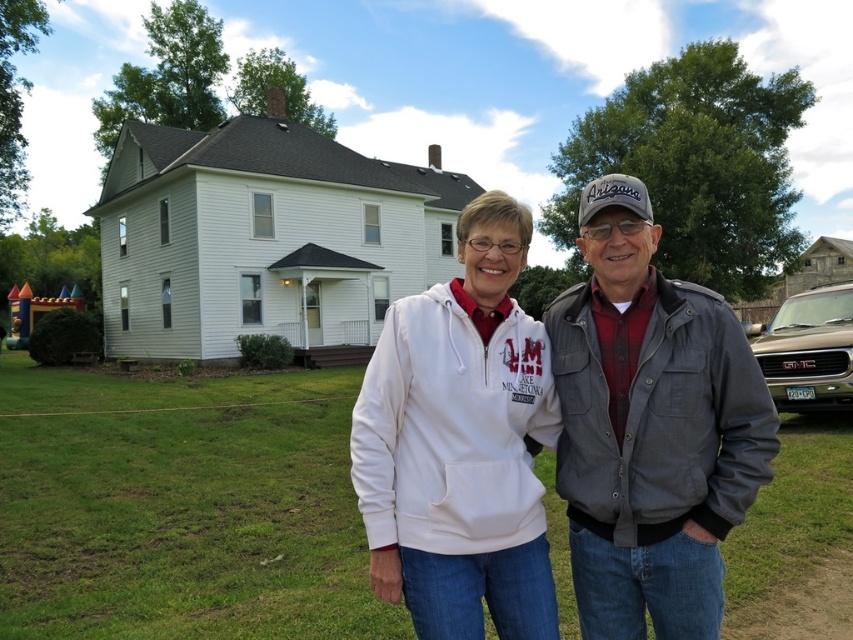
You are a fashion designer observing two people at the front of a house. You need to determine which clothing item is shorter between the gray cotton jacket at center and the white fleece hoodie at center. Which one should you choose?

The gray cotton jacket at center is shorter than the white fleece hoodie at center, so you should choose the gray cotton jacket at center.

You are standing in front of the house and want to locate the gray cotton jacket at center. Based on the coordinates provided, where should you look relative to the house?

The gray cotton jacket at center is located at coordinates point 0.669 on the horizontal axis and 0.763 on the vertical axis relative to the house.